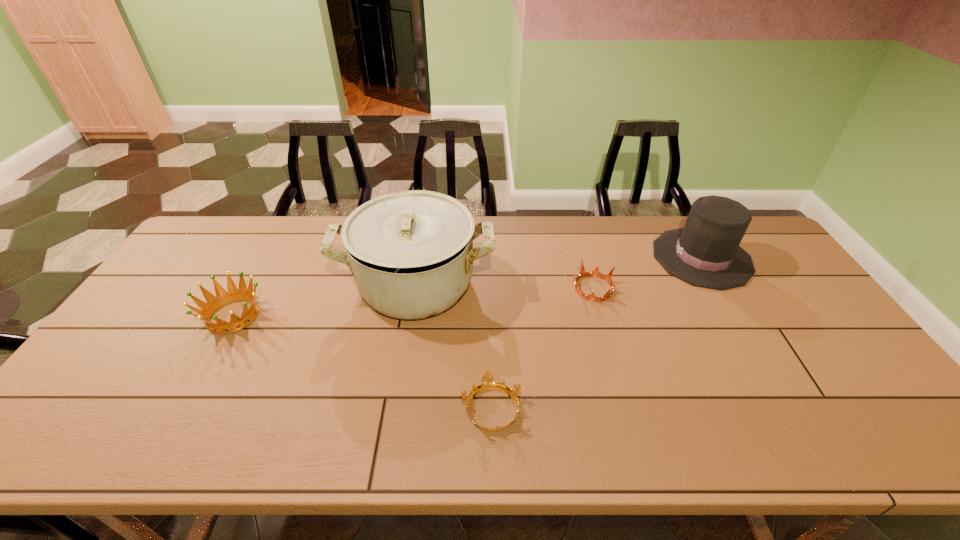
You are a GUI agent. You are given a task and a screenshot of the screen. Output one action in this format:
    pyautogui.click(x=<x>, y=<y>)
    Task: Click on the free space at the far edge of the desktop
    The height and width of the screenshot is (540, 960).
    Given the screenshot: What is the action you would take?
    pyautogui.click(x=493, y=219)

Find the location of a particular element. Image resolution: width=960 pixels, height=540 pixels. blank space at the near edge of the desktop is located at coordinates (241, 427).

In the image, there is a desktop. Where is `vacant space at the left edge`? The width and height of the screenshot is (960, 540). vacant space at the left edge is located at coordinates (112, 371).

Identify the location of vacant space at the right edge of the desktop. (780, 294).

Find the location of a particular element. vacant space at the near right corner is located at coordinates (885, 422).

Identify the location of vacant area that lies between the nearest crown and the fourth object from left to right. (542, 348).

You are a GUI agent. You are given a task and a screenshot of the screen. Output one action in this format:
    pyautogui.click(x=<x>, y=<y>)
    Task: Click on the vacant area that lies between the nearest crown and the dress hat
    This screenshot has width=960, height=540.
    Given the screenshot: What is the action you would take?
    pyautogui.click(x=596, y=333)

At what (x,y) coordinates should I click in order to perform the action: click on free spot between the nearest crown and the tallest object. Please return your answer as a coordinate pair (x, y). This screenshot has height=540, width=960. Looking at the image, I should click on (454, 347).

Identify the location of vacant space that is in between the nearest crown and the tallest object. This screenshot has width=960, height=540. (454, 347).

Image resolution: width=960 pixels, height=540 pixels. In order to click on vacant space that is in between the nearest object and the rightmost object in this screenshot , I will do click(596, 333).